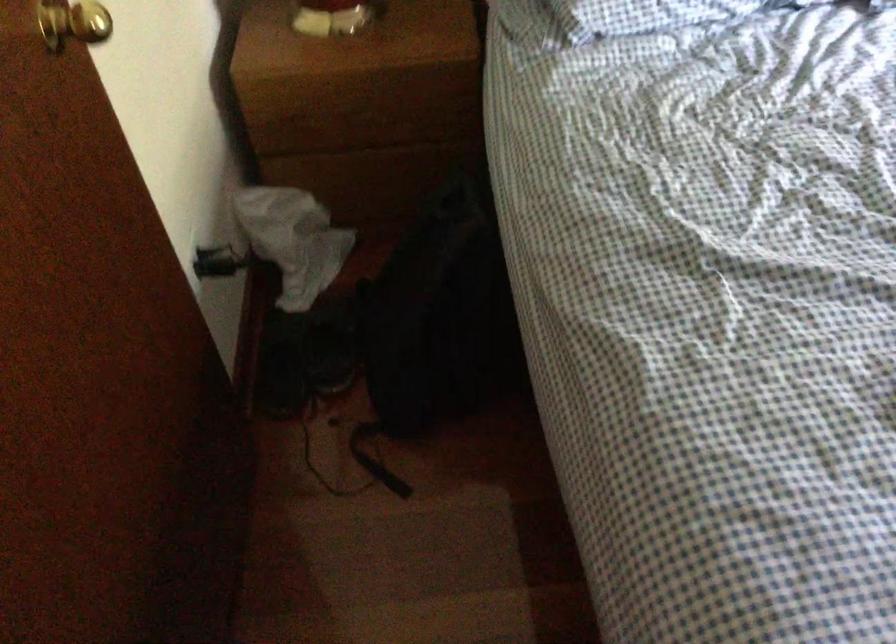
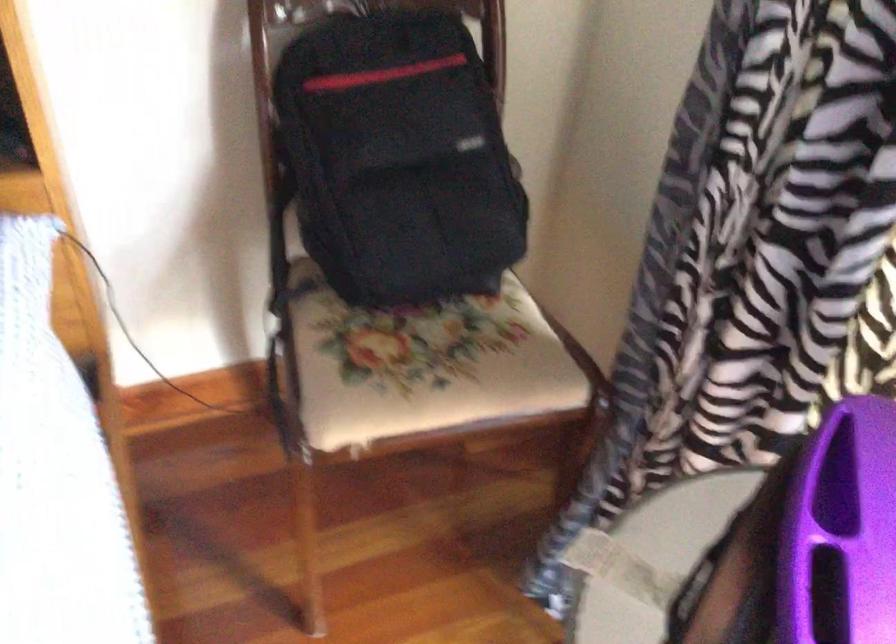
Which direction would the cameraman need to move to produce the second image?

The cameraman moved toward right, forward.